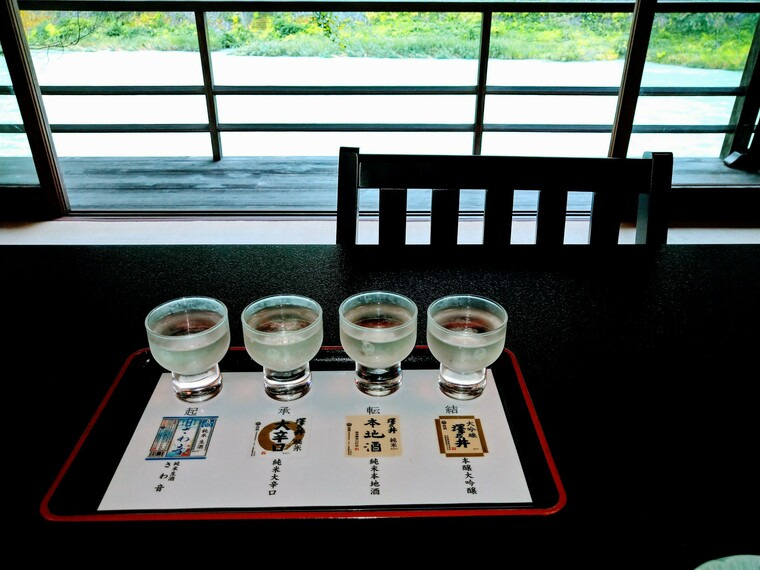
The width and height of the screenshot is (760, 570). Find the location of `tray`. tray is located at coordinates 86,460.